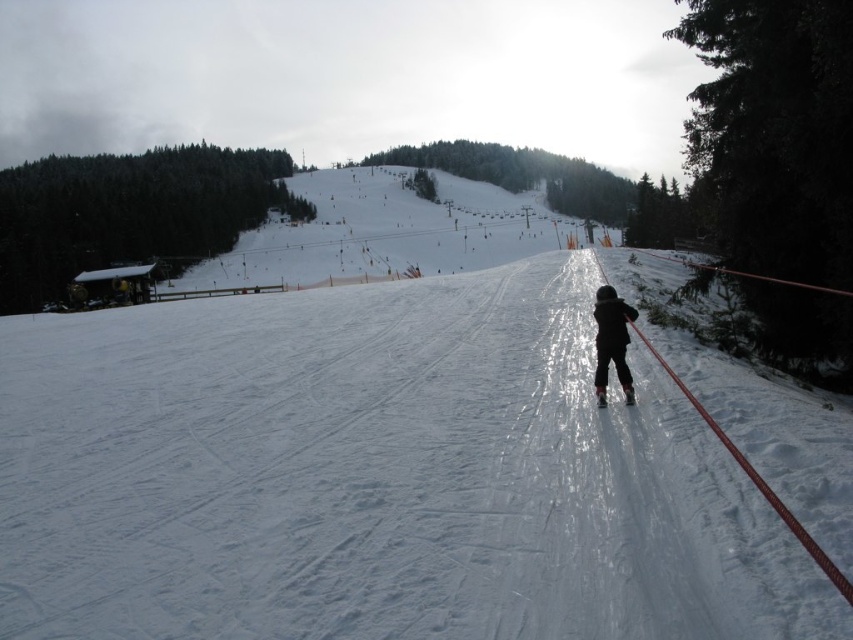
Which is in front, point (114, 593) or point (610, 344)?

Point (114, 593)

Between white smooth snow at center and black matte snowsuit at center, which one appears on the left side from the viewer's perspective?

From the viewer's perspective, white smooth snow at center appears more on the left side.

The image size is (853, 640). Describe the element at coordinates (368, 474) in the screenshot. I see `white smooth snow at center` at that location.

I want to click on white smooth snow at center, so click(x=368, y=474).

Which is in front, point (619, 420) or point (604, 394)?

Point (619, 420) is in front.

Can you confirm if white smooth snow at center is wider than matte black ski at center?

Indeed, white smooth snow at center has a greater width compared to matte black ski at center.

I want to click on white smooth snow at center, so click(x=368, y=474).

In the scene shown: How much distance is there between black matte snowsuit at center and matte black ski at center?

black matte snowsuit at center is 3.45 feet from matte black ski at center.

Consider the image. Is black matte snowsuit at center below matte black ski at center?

Incorrect, black matte snowsuit at center is not positioned below matte black ski at center.

Who is more distant from viewer, (601, 308) or (631, 400)?

The point (601, 308) is behind.

Find the location of a particular element. This screenshot has width=853, height=640. black matte snowsuit at center is located at coordinates (611, 340).